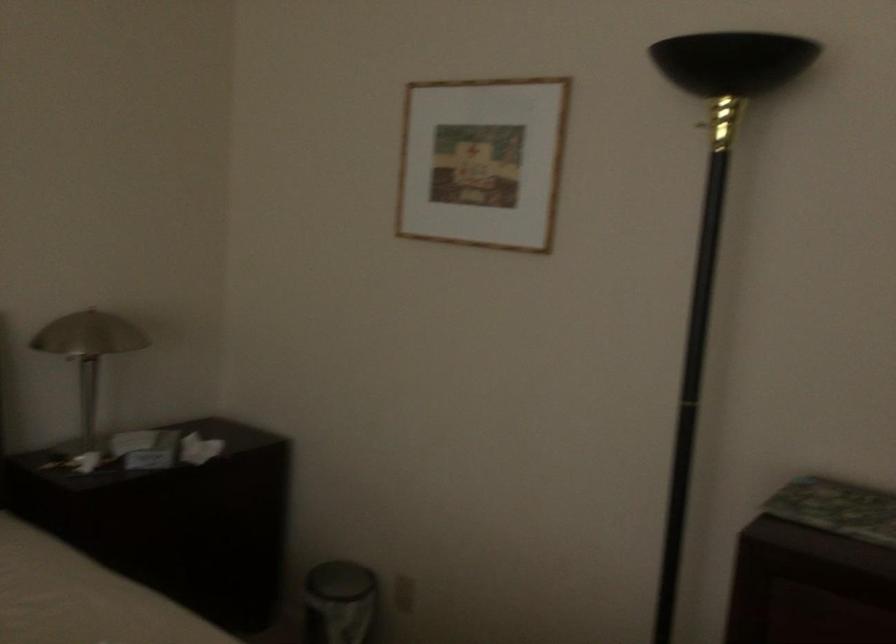
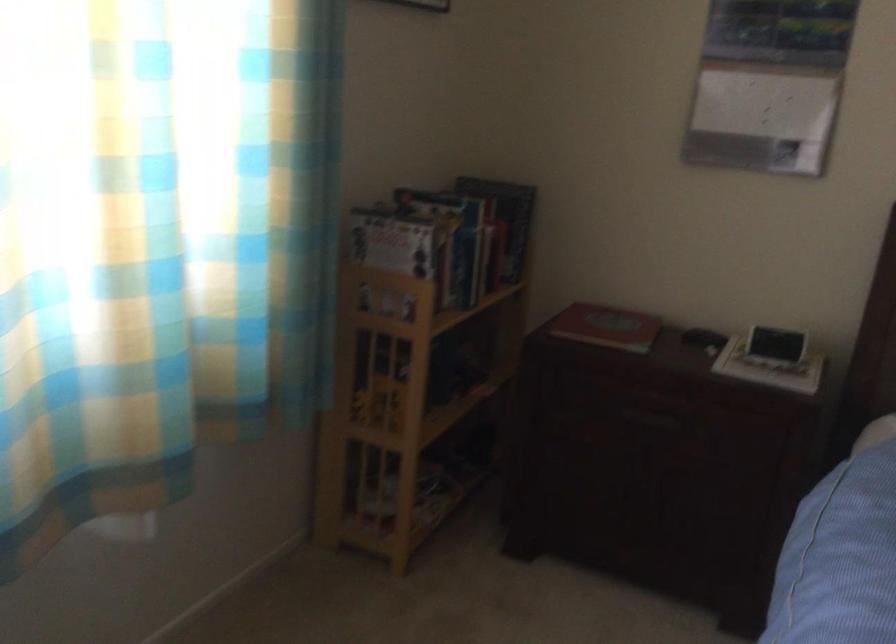
Question: The camera is either moving clockwise (left) or counter-clockwise (right) around the object. The first image is from the beginning of the video and the second image is from the end. Is the camera moving left or right when shooting the video?

Choices:
 (A) Left
 (B) Right

Answer: (B)